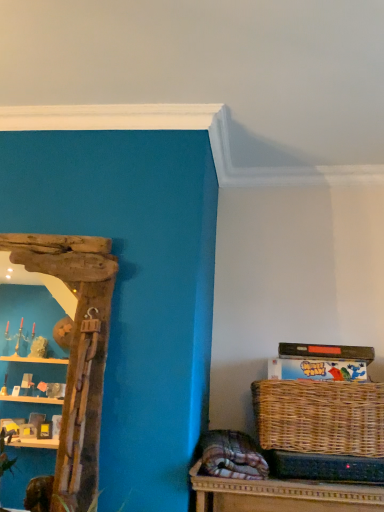
Where is `blank space situated above driftwood mirror at left (from a real-world perspective)`? blank space situated above driftwood mirror at left (from a real-world perspective) is located at coordinates (52, 236).